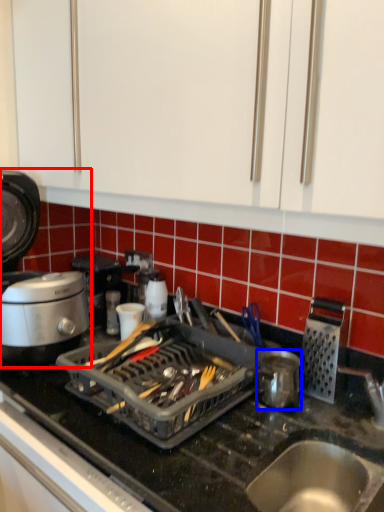
Question: Among these objects, which one is farthest to the camera, kitchen appliance (highlighted by a red box) or kitchen appliance (highlighted by a blue box)?

Choices:
 (A) kitchen appliance
 (B) kitchen appliance

Answer: (B)